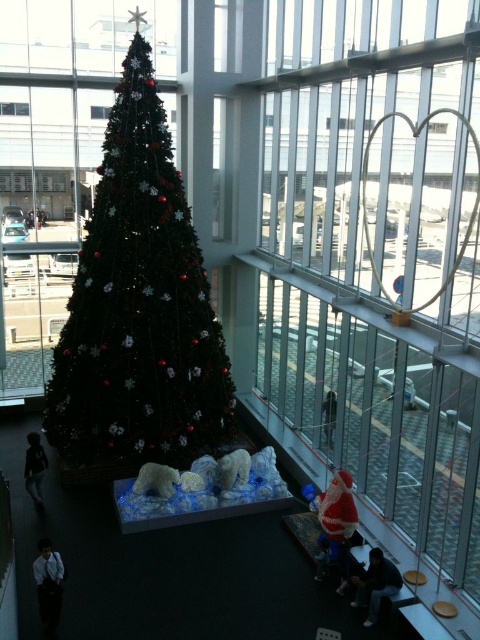
You are standing in the room and want to place a gift box between the shiny green christmas tree at center and the white plush bear at center. Based on their positions, which object should the gift box be closer to?

The shiny green christmas tree at center is to the left of white plush bear at center, so the gift box should be placed closer to the shiny green christmas tree at center.

You are a photographer planning to take a photo of the shiny green christmas tree at center and the fluffy white bear at center. You want to ensure both are in focus. Which object should you focus on first to ensure proper depth of field?

The shiny green christmas tree at center is taller than the fluffy white bear at center, so you should focus on the taller object first to ensure proper depth of field.